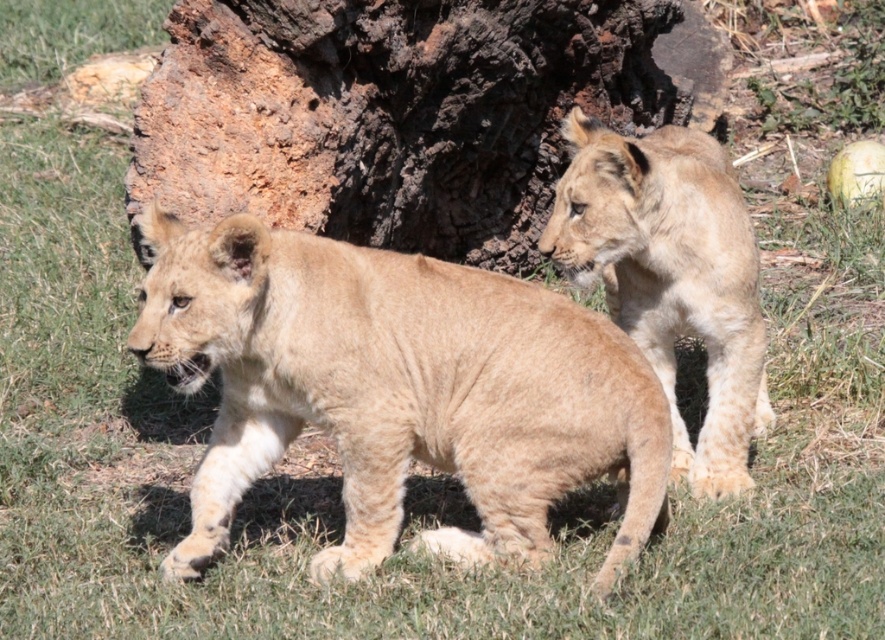
Is fuzzy beige lion cub at center below light brown fur at right?

Correct, fuzzy beige lion cub at center is located below light brown fur at right.

Does fuzzy beige lion cub at center have a lesser width compared to light brown fur at right?

No.

Is point (370, 406) positioned behind point (750, 433)?

No.

Locate an element on the screen. The image size is (885, 640). fuzzy beige lion cub at center is located at coordinates (397, 388).